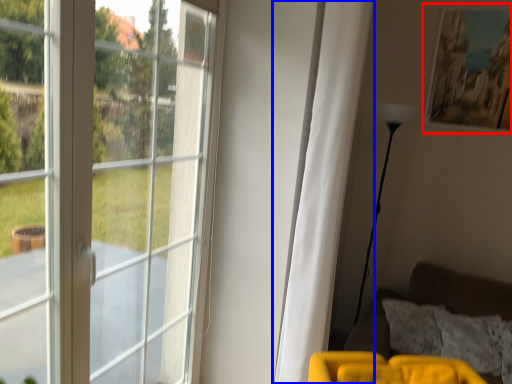
Question: Which of the following is the closest to the observer, picture frame (highlighted by a red box) or curtain (highlighted by a blue box)?

Choices:
 (A) picture frame
 (B) curtain

Answer: (B)